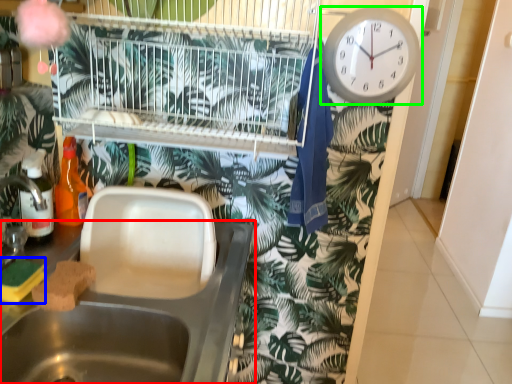
Question: Considering the real-world distances, which object is closest to sink (highlighted by a red box)? food (highlighted by a blue box) or wall clock (highlighted by a green box).

Choices:
 (A) food
 (B) wall clock

Answer: (A)